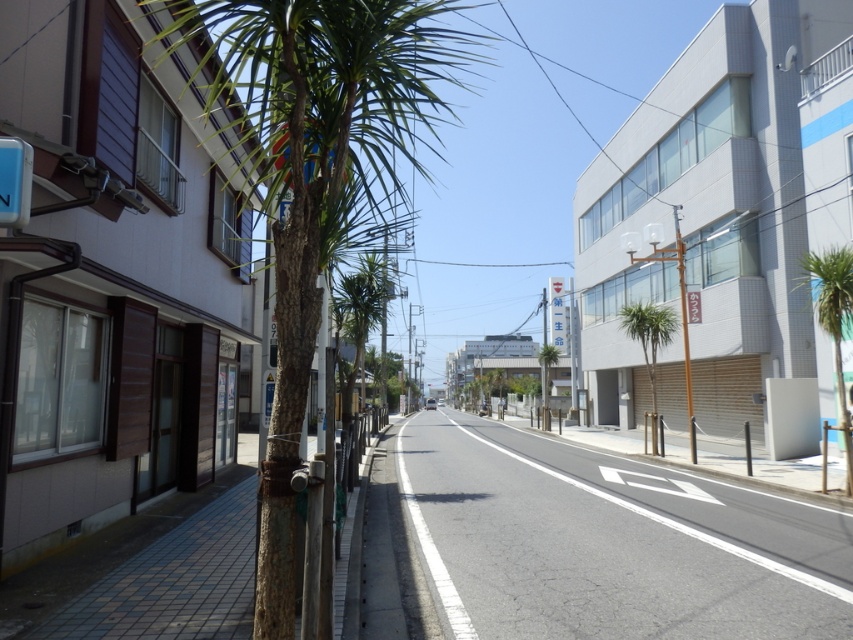
You are a delivery person trying to cross the gray asphalt road at center to reach the green leafy palm tree at center. Based on the scene, can you safely walk across the road without needing to look up?

The gray asphalt road at center is shorter than the green leafy palm tree at center, so the road is shorter in height than the palm tree. However, since the road is at ground level and the palm tree is standing upright, the height comparison might not directly affect your ability to cross. The question mentions looking up, which might relate to obstacles above. Since the scene description doesn not mention any overhead obstacles like low branches or wires, you can safely walk across the gray asphalt road at

You are standing at the center of the street and want to reach the green textured palm tree at left. Which direction should you move in to get there?

You should move to the left to reach the green textured palm tree at left since it is located at point (x=317, y=177), which is on the left side of the street.